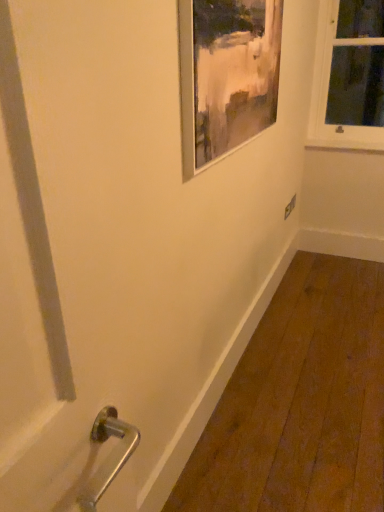
You are a GUI agent. You are given a task and a screenshot of the screen. Output one action in this format:
    pyautogui.click(x=<x>, y=<y>)
    Task: Click on the vacant area on top of white matte window sill at upper right (from a real-world perspective)
    
    Given the screenshot: What is the action you would take?
    pyautogui.click(x=345, y=135)